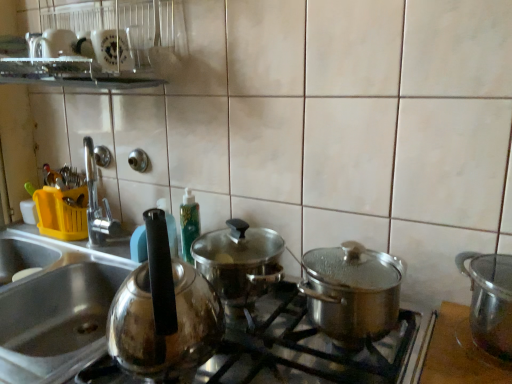
Question: Is shiny metallic pots at center smaller than satin silver sink at left?

Choices:
 (A) no
 (B) yes

Answer: (B)

Question: From a real-world perspective, does shiny metallic pots at center stand above satin silver sink at left?

Choices:
 (A) yes
 (B) no

Answer: (A)

Question: Can you confirm if shiny metallic pots at center is positioned to the right of satin silver sink at left?

Choices:
 (A) yes
 (B) no

Answer: (A)

Question: Can you confirm if shiny metallic pots at center is shorter than satin silver sink at left?

Choices:
 (A) yes
 (B) no

Answer: (A)

Question: Is shiny metallic pots at center bigger than satin silver sink at left?

Choices:
 (A) yes
 (B) no

Answer: (B)

Question: Is satin silver sink at left inside or outside of shiny metallic pot at center, arranged as the 2th kitchen appliance when viewed from the right?

Choices:
 (A) inside
 (B) outside

Answer: (B)

Question: Relative to shiny metallic pot at center, arranged as the 2th kitchen appliance when viewed from the right, is satin silver sink at left in front or behind?

Choices:
 (A) front
 (B) behind

Answer: (B)

Question: In terms of width, does satin silver sink at left look wider or thinner when compared to shiny metallic pot at center, which is counted as the first kitchen appliance, starting from the left?

Choices:
 (A) wide
 (B) thin

Answer: (A)

Question: From the image's perspective, relative to shiny metallic pot at center, arranged as the 2th kitchen appliance when viewed from the right, is satin silver sink at left above or below?

Choices:
 (A) above
 (B) below

Answer: (B)

Question: Considering the positions of shiny metallic pot at center, arranged as the 2th kitchen appliance when viewed from the right, and satin silver sink at left in the image, is shiny metallic pot at center, arranged as the 2th kitchen appliance when viewed from the right, bigger or smaller than satin silver sink at left?

Choices:
 (A) small
 (B) big

Answer: (A)

Question: Does point (313, 266) appear closer or farther from the camera than point (75, 306)?

Choices:
 (A) closer
 (B) farther

Answer: (A)

Question: Do you think shiny metallic pot at center, which is counted as the first kitchen appliance, starting from the left, is within satin silver sink at left, or outside of it?

Choices:
 (A) inside
 (B) outside

Answer: (B)

Question: Considering the positions of shiny metallic pot at center, arranged as the 2th kitchen appliance when viewed from the right, and satin silver sink at left in the image, is shiny metallic pot at center, arranged as the 2th kitchen appliance when viewed from the right, taller or shorter than satin silver sink at left?

Choices:
 (A) short
 (B) tall

Answer: (A)

Question: Does point (480, 278) appear closer or farther from the camera than point (101, 264)?

Choices:
 (A) closer
 (B) farther

Answer: (A)

Question: From the image's perspective, is shiny metallic pot at right, the 2th kitchen appliance when ordered from left to right, above or below satin silver sink at left?

Choices:
 (A) below
 (B) above

Answer: (B)